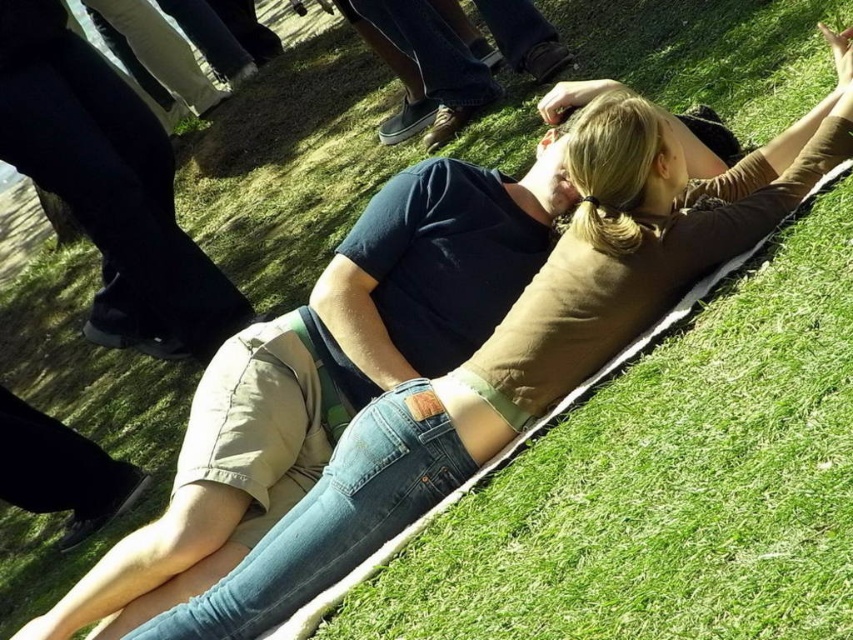
Question: Which point is closer to the camera taking this photo?

Choices:
 (A) (527, 8)
 (B) (102, 77)

Answer: (B)

Question: Can you confirm if black matte pants at lower left is positioned to the right of denim shorts at center?

Choices:
 (A) no
 (B) yes

Answer: (A)

Question: Which point is farther to the camera?

Choices:
 (A) (227, 323)
 (B) (399, 10)

Answer: (B)

Question: Can you confirm if black matte pants at lower left is bigger than denim shorts at center?

Choices:
 (A) yes
 (B) no

Answer: (A)

Question: Is black matte pants at lower left below denim shorts at center?

Choices:
 (A) yes
 (B) no

Answer: (A)